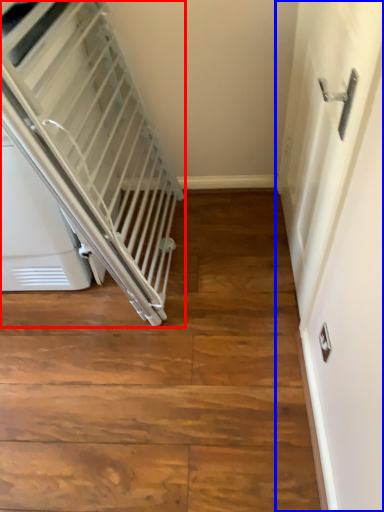
Question: Which object is closer to the camera taking this photo, escalator (highlighted by a red box) or door (highlighted by a blue box)?

Choices:
 (A) escalator
 (B) door

Answer: (B)